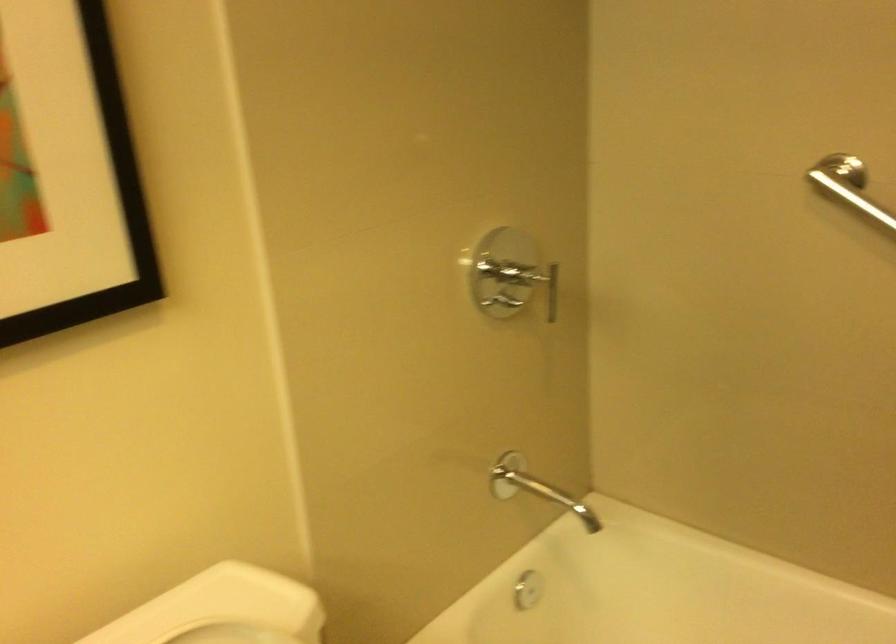
The image size is (896, 644). I want to click on faucet diverter knob, so click(x=527, y=590).